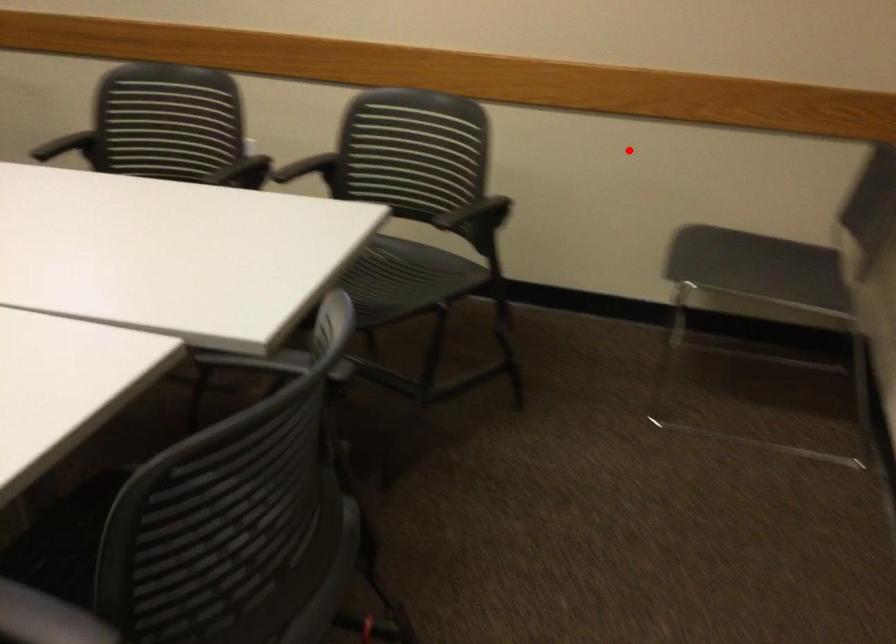
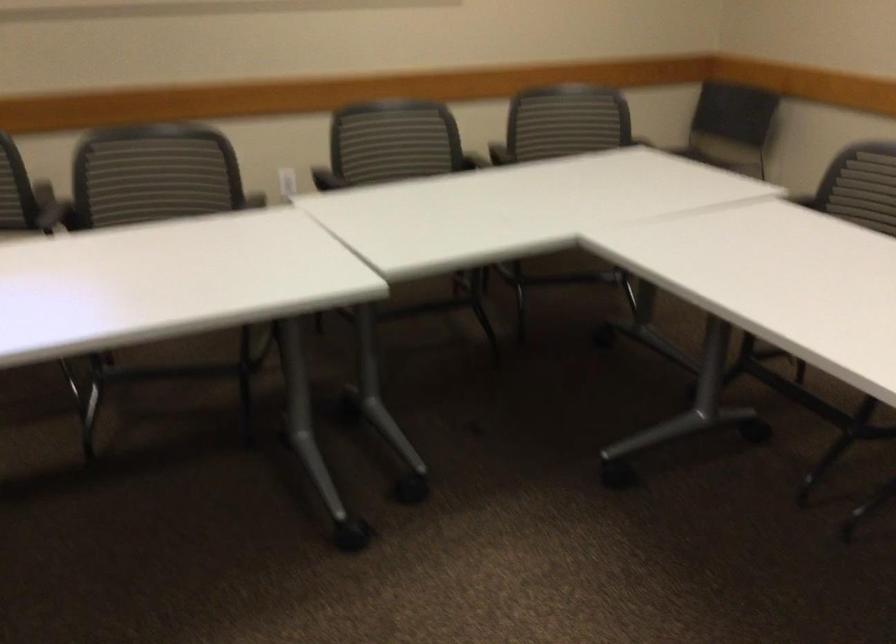
In the second image, find the point that corresponds to the highlighted location in the first image.

(569, 114)